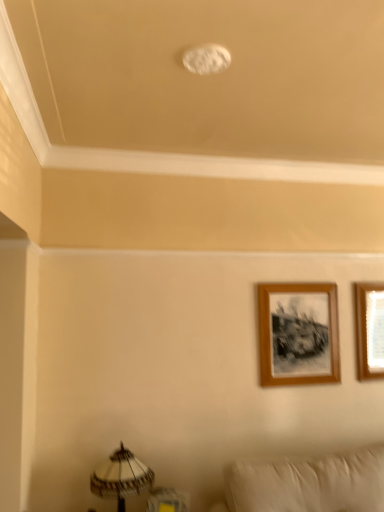
At what (x,y) coordinates should I click in order to perform the action: click on wooden frame at upper right, positioned as the 2th picture frame in right-to-left order. Please return your answer as a coordinate pair (x, y). Looking at the image, I should click on (298, 333).

At what (x,y) coordinates should I click in order to perform the action: click on wooden frame at upper right, which is counted as the 1th picture frame, starting from the left. Please return your answer as a coordinate pair (x, y). Looking at the image, I should click on (298, 333).

Is wooden picture frame at upper right, which is the second picture frame from left to right, aimed at wooden frame at upper right, positioned as the 2th picture frame in right-to-left order?

No, wooden picture frame at upper right, which is the second picture frame from left to right, is not facing towards wooden frame at upper right, positioned as the 2th picture frame in right-to-left order.

Is wooden frame at upper right, which is counted as the 1th picture frame, starting from the left, inside wooden picture frame at upper right, which is the second picture frame from left to right?

No, wooden picture frame at upper right, which is the second picture frame from left to right, does not contain wooden frame at upper right, which is counted as the 1th picture frame, starting from the left.

From the image's perspective, is wooden picture frame at upper right, the first picture frame when ordered from right to left, located above wooden frame at upper right, which is counted as the 1th picture frame, starting from the left?

Yes.

Which is behind, point (366, 286) or point (288, 289)?

The point (366, 286) is behind.

Considering the relative sizes of wooden frame at upper right, which is counted as the 1th picture frame, starting from the left, and white textured lampshade at lower left in the image provided, is wooden frame at upper right, which is counted as the 1th picture frame, starting from the left, bigger than white textured lampshade at lower left?

Incorrect, wooden frame at upper right, which is counted as the 1th picture frame, starting from the left, is not larger than white textured lampshade at lower left.

Is wooden frame at upper right, which is counted as the 1th picture frame, starting from the left, wider than white textured lampshade at lower left?

In fact, wooden frame at upper right, which is counted as the 1th picture frame, starting from the left, might be narrower than white textured lampshade at lower left.

How distant is wooden frame at upper right, which is counted as the 1th picture frame, starting from the left, from white textured lampshade at lower left?

wooden frame at upper right, which is counted as the 1th picture frame, starting from the left, and white textured lampshade at lower left are 3.63 feet apart from each other.

From a real-world perspective, between wooden frame at upper right, positioned as the 2th picture frame in right-to-left order, and white textured lampshade at lower left, who is vertically higher?

In real-world perspective, wooden frame at upper right, positioned as the 2th picture frame in right-to-left order, is above.

Does point (282, 315) appear closer or farther from the camera than point (356, 324)?

Clearly, point (282, 315) is closer to the camera than point (356, 324).

Find the location of `picture frame lying below the wooden picture frame at upper right, which is the second picture frame from left to right (from the image's perspective)`. picture frame lying below the wooden picture frame at upper right, which is the second picture frame from left to right (from the image's perspective) is located at coordinates (298, 333).

From a real-world perspective, is wooden frame at upper right, which is counted as the 1th picture frame, starting from the left, physically located above or below wooden picture frame at upper right, which is the second picture frame from left to right?

Clearly, from a real-world perspective, wooden frame at upper right, which is counted as the 1th picture frame, starting from the left, is below wooden picture frame at upper right, which is the second picture frame from left to right.

Would you say white textured lampshade at lower left is outside wooden frame at upper right, positioned as the 2th picture frame in right-to-left order?

Yes, white textured lampshade at lower left is not within wooden frame at upper right, positioned as the 2th picture frame in right-to-left order.

Looking at their sizes, would you say white textured lampshade at lower left is wider or thinner than wooden frame at upper right, which is counted as the 1th picture frame, starting from the left?

Considering their sizes, white textured lampshade at lower left looks broader than wooden frame at upper right, which is counted as the 1th picture frame, starting from the left.

Can you confirm if white textured lampshade at lower left is bigger than wooden frame at upper right, which is counted as the 1th picture frame, starting from the left?

Correct, white textured lampshade at lower left is larger in size than wooden frame at upper right, which is counted as the 1th picture frame, starting from the left.

There is a white textured lampshade at lower left. Identify the location of the 1st picture frame above it (from the image's perspective). (298, 333).

Is white textured lampshade at lower left directly adjacent to wooden picture frame at upper right, the first picture frame when ordered from right to left?

No, white textured lampshade at lower left is not making contact with wooden picture frame at upper right, the first picture frame when ordered from right to left.

Based on the photo, considering the sizes of white textured lampshade at lower left and wooden picture frame at upper right, the first picture frame when ordered from right to left, in the image, is white textured lampshade at lower left bigger or smaller than wooden picture frame at upper right, the first picture frame when ordered from right to left,?

Clearly, white textured lampshade at lower left is larger in size than wooden picture frame at upper right, the first picture frame when ordered from right to left.

How much distance is there between white textured lampshade at lower left and wooden picture frame at upper right, the first picture frame when ordered from right to left?

white textured lampshade at lower left and wooden picture frame at upper right, the first picture frame when ordered from right to left, are 5.18 feet apart.

Is wooden picture frame at upper right, which is the second picture frame from left to right, not close to white textured lampshade at lower left?

Absolutely, wooden picture frame at upper right, which is the second picture frame from left to right, is distant from white textured lampshade at lower left.

Considering the sizes of objects wooden picture frame at upper right, the first picture frame when ordered from right to left, and white textured lampshade at lower left in the image provided, who is bigger, wooden picture frame at upper right, the first picture frame when ordered from right to left, or white textured lampshade at lower left?

white textured lampshade at lower left is bigger.

From a real-world perspective, is wooden picture frame at upper right, which is the second picture frame from left to right, over white textured lampshade at lower left?

Indeed, from a real-world perspective, wooden picture frame at upper right, which is the second picture frame from left to right, stands above white textured lampshade at lower left.

Is wooden picture frame at upper right, the first picture frame when ordered from right to left, to the left of white textured lampshade at lower left from the viewer's perspective?

In fact, wooden picture frame at upper right, the first picture frame when ordered from right to left, is to the right of white textured lampshade at lower left.

Image resolution: width=384 pixels, height=512 pixels. I want to click on picture frame above the wooden frame at upper right, which is counted as the 1th picture frame, starting from the left (from the image's perspective), so click(x=370, y=330).

Locate an element on the screen. The width and height of the screenshot is (384, 512). table lamp in front of the wooden frame at upper right, which is counted as the 1th picture frame, starting from the left is located at coordinates (121, 477).

Looking at the image, which one is located closer to wooden picture frame at upper right, the first picture frame when ordered from right to left, wooden frame at upper right, which is counted as the 1th picture frame, starting from the left, or white textured lampshade at lower left?

wooden frame at upper right, which is counted as the 1th picture frame, starting from the left, lies closer to wooden picture frame at upper right, the first picture frame when ordered from right to left, than the other object.

When comparing their distances from wooden frame at upper right, which is counted as the 1th picture frame, starting from the left, does wooden picture frame at upper right, the first picture frame when ordered from right to left, or white textured lampshade at lower left seem further?

white textured lampshade at lower left is positioned further to the anchor wooden frame at upper right, which is counted as the 1th picture frame, starting from the left.

Looking at this image, estimate the real-world distances between objects in this image. Which object is further from wooden frame at upper right, which is counted as the 1th picture frame, starting from the left, white textured lampshade at lower left or wooden picture frame at upper right, which is the second picture frame from left to right?

white textured lampshade at lower left is positioned further to the anchor wooden frame at upper right, which is counted as the 1th picture frame, starting from the left.

Consider the image. When comparing their distances from white textured lampshade at lower left, does wooden frame at upper right, positioned as the 2th picture frame in right-to-left order, or wooden picture frame at upper right, the first picture frame when ordered from right to left, seem closer?

wooden frame at upper right, positioned as the 2th picture frame in right-to-left order, lies closer to white textured lampshade at lower left than the other object.

Looking at the image, which one is located closer to white textured lampshade at lower left, wooden picture frame at upper right, the first picture frame when ordered from right to left, or wooden frame at upper right, positioned as the 2th picture frame in right-to-left order?

wooden frame at upper right, positioned as the 2th picture frame in right-to-left order, is closer to white textured lampshade at lower left.

Estimate the real-world distances between objects in this image. Which object is closer to wooden picture frame at upper right, the first picture frame when ordered from right to left, white textured lampshade at lower left or wooden frame at upper right, positioned as the 2th picture frame in right-to-left order?

Among the two, wooden frame at upper right, positioned as the 2th picture frame in right-to-left order, is located nearer to wooden picture frame at upper right, the first picture frame when ordered from right to left.

The image size is (384, 512). I want to click on picture frame between white textured lampshade at lower left and wooden picture frame at upper right, which is the second picture frame from left to right, in the horizontal direction, so click(x=298, y=333).